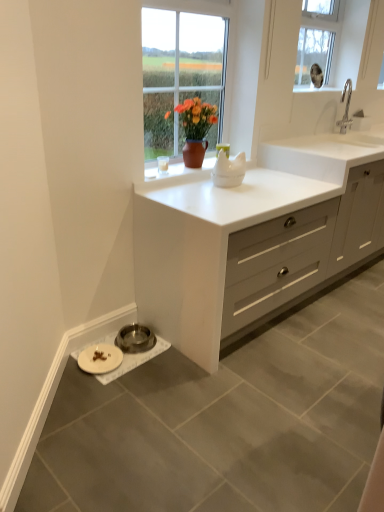
Find the location of a particular element. Image resolution: width=384 pixels, height=512 pixels. unoccupied region to the right of white matte plate at lower left is located at coordinates (137, 362).